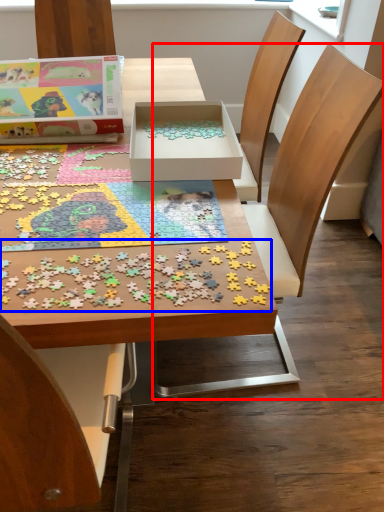
Question: Which object is closer to the camera taking this photo, chair (highlighted by a red box) or jigsaw puzzle (highlighted by a blue box)?

Choices:
 (A) chair
 (B) jigsaw puzzle

Answer: (B)